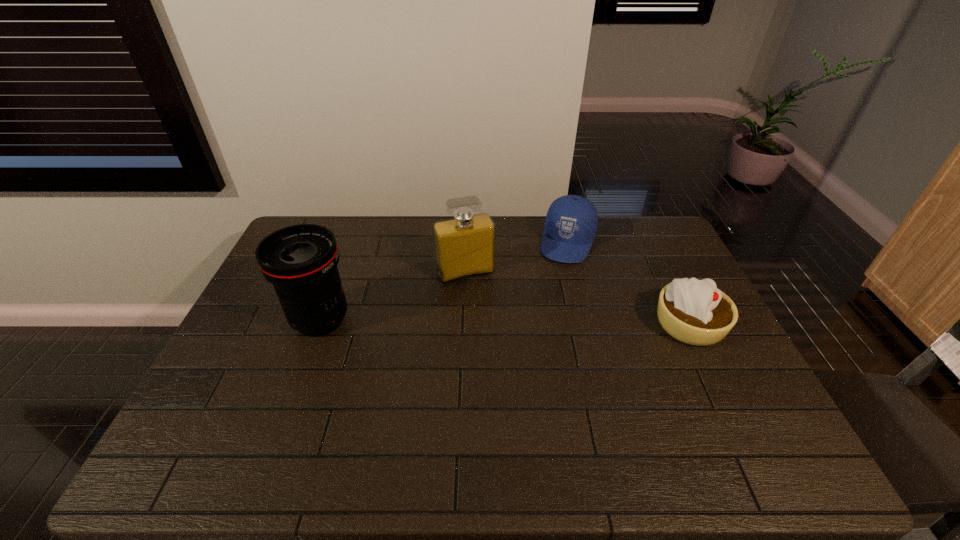
Where is `free space on the desktop that is between the leftmost object and the whipped cream and is positioned on the front-facing side of the perfume`? The height and width of the screenshot is (540, 960). free space on the desktop that is between the leftmost object and the whipped cream and is positioned on the front-facing side of the perfume is located at coordinates (488, 322).

Locate an element on the screen. Image resolution: width=960 pixels, height=540 pixels. free spot on the desktop that is between the telephoto lens and the rightmost object and is positioned on the front-facing side of the second object from right to left is located at coordinates (539, 323).